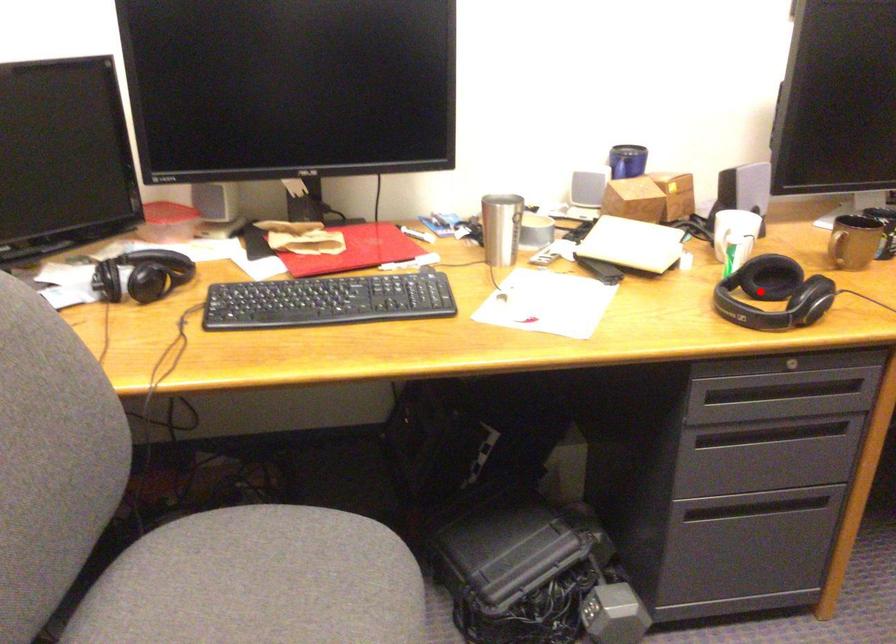
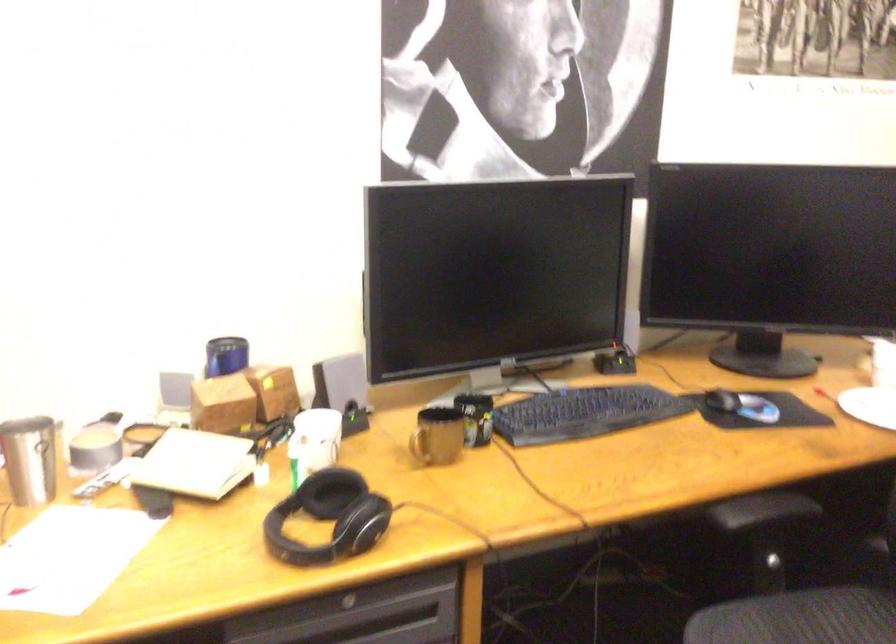
Question: A red point is marked in image1. In image2, is the corresponding 3D point closer to the camera or farther? Reply with the corresponding letter.

Choices:
 (A) The corresponding 3D point is closer.
 (B) The corresponding 3D point is farther.

Answer: (A)